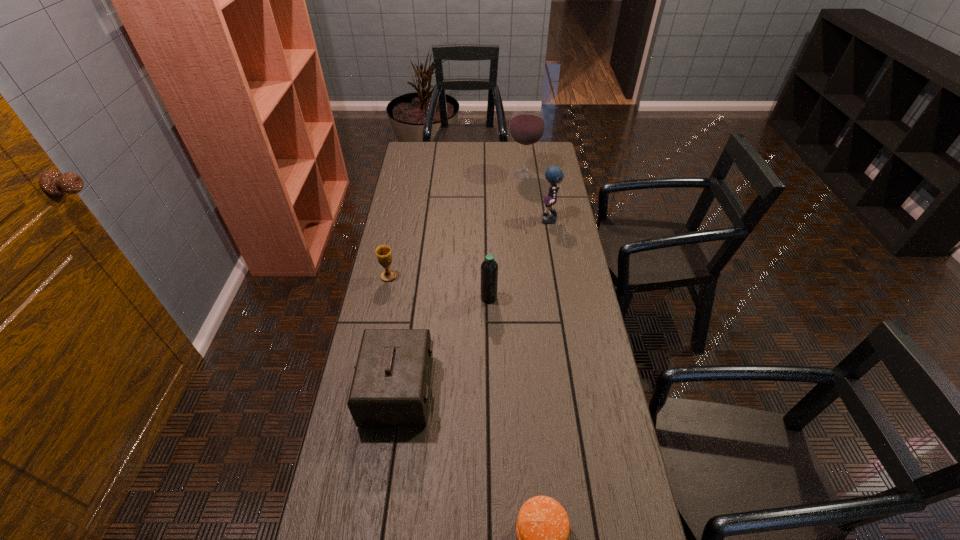
Identify the location of alcohol at the right edge. This screenshot has height=540, width=960. (527, 125).

The height and width of the screenshot is (540, 960). What are the coordinates of `rag doll that is at the right edge` in the screenshot? It's located at (553, 174).

At what (x,y) coordinates should I click in order to perform the action: click on object at the far right corner. Please return your answer as a coordinate pair (x, y). The height and width of the screenshot is (540, 960). Looking at the image, I should click on (527, 125).

I want to click on vacant space at the far edge of the desktop, so click(x=507, y=151).

In the image, there is a desktop. Identify the location of vacant region at the left edge. This screenshot has width=960, height=540. (425, 183).

In the image, there is a desktop. In order to click on vacant space at the right edge in this screenshot , I will do `click(550, 336)`.

Where is `vacant space at the far right corner`? vacant space at the far right corner is located at coordinates click(x=534, y=156).

I want to click on free space between the third object from left to right and the farthest object, so click(x=506, y=237).

I want to click on unoccupied position between the farthest object and the first-aid kit, so click(x=461, y=282).

The width and height of the screenshot is (960, 540). Find the location of `object that can be found as the third closest to the chalice`. object that can be found as the third closest to the chalice is located at coordinates click(553, 174).